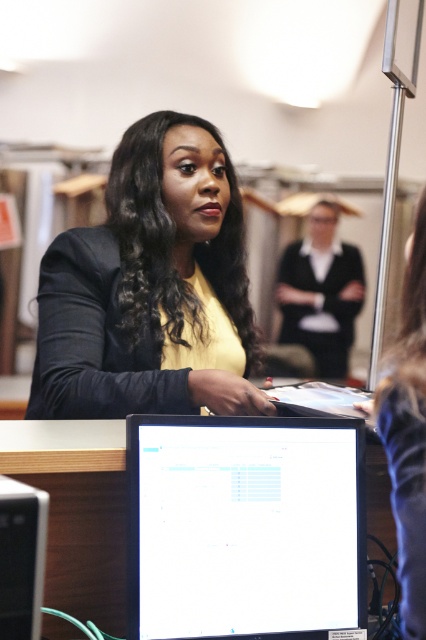
You are standing in front of the desk in the image. There is a point at coordinates (408, 353) on the desk. If you want to place a 30 inch laptop on the desk, will it fit from the edge of the desk to that point?

The distance from the camera to the point is 38.58 inches. Since the laptop is 30 inches long, it will fit as 30 is less than 38.58.

You are an office worker who needs to locate the white plastic computer tower at lower left. From the perspective of the woman with smooth black hair at center, which direction should you look to find it?

The smooth black hair at center is to the right of the white plastic computer tower at lower left, so from the woman perspective, the white plastic computer tower at lower left would be to her left side.

Based on the scene description, where is the smooth black hair at center located in terms of its 2D coordinates?

The smooth black hair at center is located at the 2D coordinates of point (408,429).